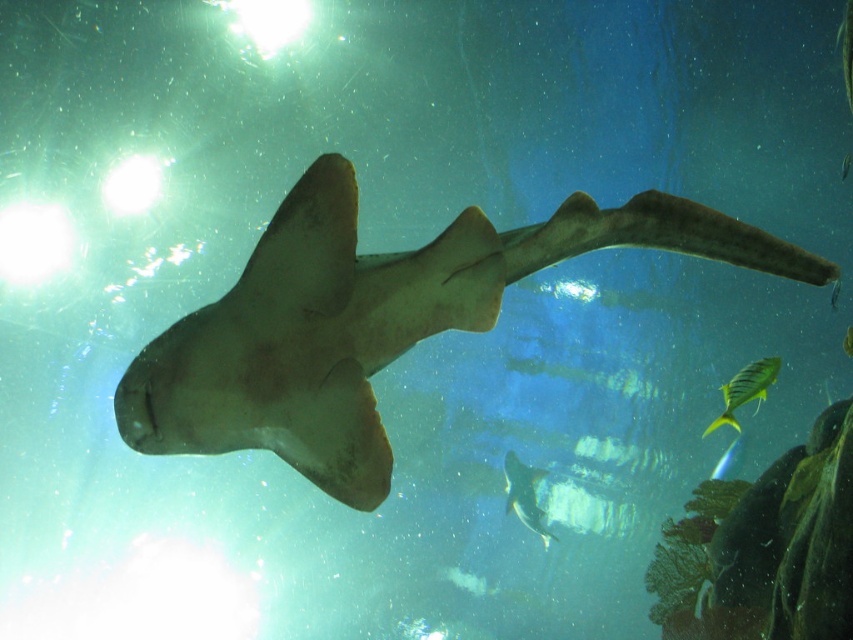
You are a marine biologist studying underwater life. You observe the smooth tan shark at center and notice its position relative to other elements in the scene. Based on its coordinates at point 0.503, 0.438, can you determine if it is closer to the top or bottom of the image?

The smooth tan shark at center is located at point (373, 321). Since the y coordinate is 0.438, which is less than 0.5, it is closer to the bottom of the image.

You are a diver who wants to take a photo of the shiny silver fish at center without the smooth tan shark at center appearing in the frame. Which direction should you move your camera to avoid the shark?

Move your camera to the right to avoid the smooth tan shark at center, since the shiny silver fish at center is to the right of the shark.